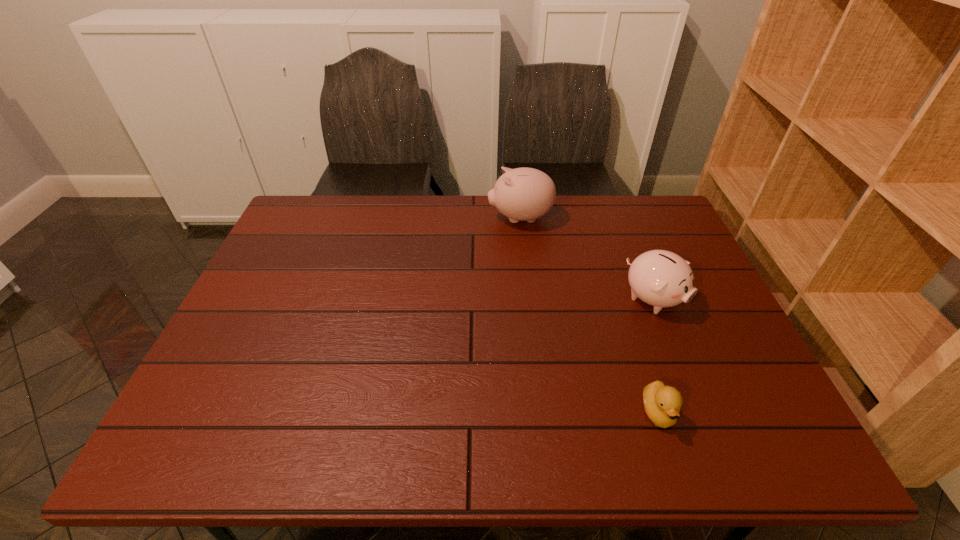
Image resolution: width=960 pixels, height=540 pixels. I want to click on object that is positioned at the far edge, so click(x=522, y=194).

Where is `object present at the near edge`? Image resolution: width=960 pixels, height=540 pixels. object present at the near edge is located at coordinates (662, 404).

Identify the location of object present at the right edge. The height and width of the screenshot is (540, 960). (660, 278).

In order to click on vacant space at the far edge in this screenshot , I will do `click(448, 197)`.

Locate an element on the screen. free spot at the near edge of the desktop is located at coordinates (246, 456).

Where is `vacant space at the left edge of the desktop`? Image resolution: width=960 pixels, height=540 pixels. vacant space at the left edge of the desktop is located at coordinates (234, 335).

In order to click on vacant area at the right edge of the desktop in this screenshot , I will do `click(652, 248)`.

In the image, there is a desktop. In order to click on vacant region at the far left corner in this screenshot , I will do `click(312, 217)`.

Where is `vacant area at the near left corner of the desktop`? vacant area at the near left corner of the desktop is located at coordinates (238, 426).

Where is `vacant region at the far right corner of the desktop`? vacant region at the far right corner of the desktop is located at coordinates point(650,214).